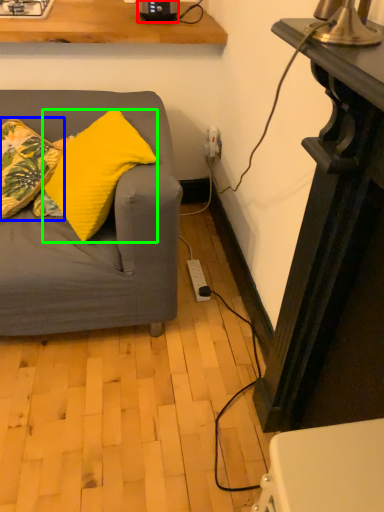
Question: Which object is the farthest from appliance (highlighted by a red box)? Choose among these: pillow (highlighted by a blue box) or pillow (highlighted by a green box).

Choices:
 (A) pillow
 (B) pillow

Answer: (B)